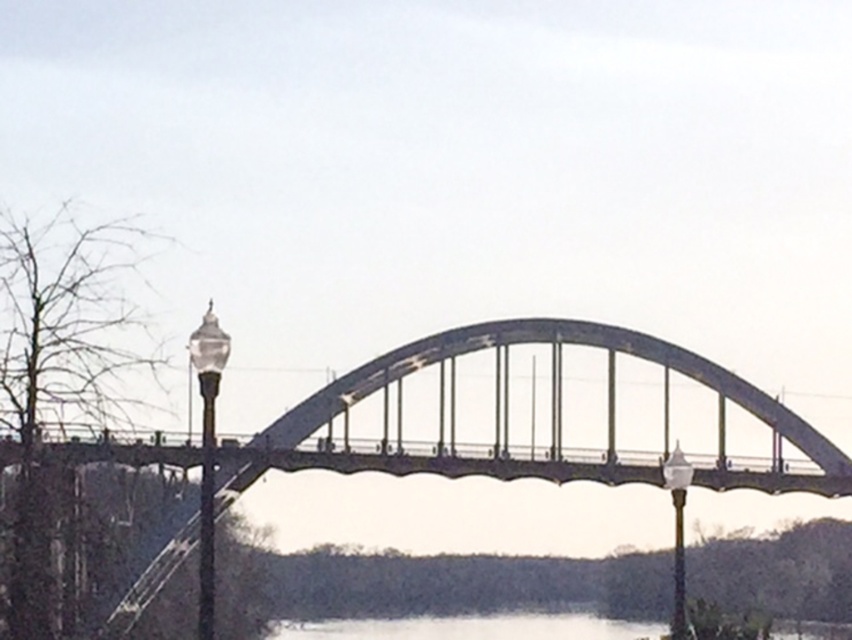
Question: Which of the following is the closest to the observer?

Choices:
 (A) clear glass lamp post at left
 (B) white glass lamp post at center

Answer: (A)

Question: Does clear glass lamp post at left have a smaller size compared to white glass lamp post at center?

Choices:
 (A) no
 (B) yes

Answer: (A)

Question: Among these points, which one is farthest from the camera?

Choices:
 (A) (666, 468)
 (B) (199, 620)

Answer: (A)

Question: Can you confirm if clear glass lamp post at left is smaller than white glass lamp post at center?

Choices:
 (A) yes
 (B) no

Answer: (B)

Question: Is clear glass lamp post at left closer to the viewer compared to white glass lamp post at center?

Choices:
 (A) no
 (B) yes

Answer: (B)